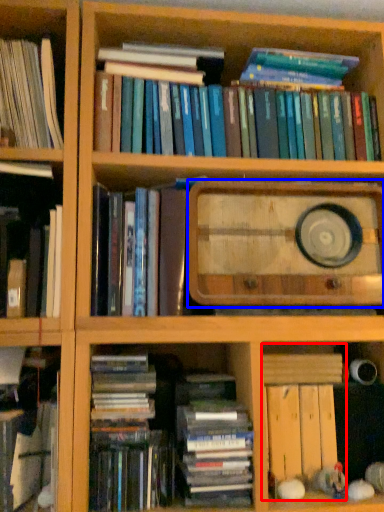
Question: Which of the following is the farthest to the observer, book (highlighted by a red box) or paperback book (highlighted by a blue box)?

Choices:
 (A) book
 (B) paperback book

Answer: (A)